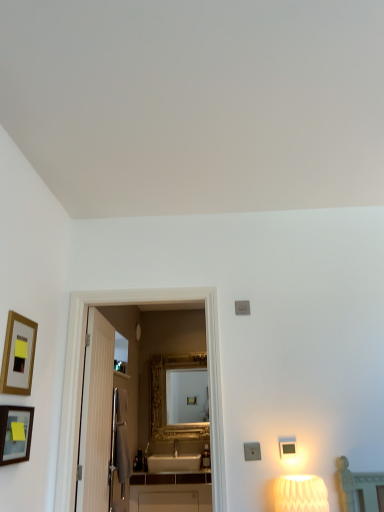
Question: Is gold-framed picture at left, positioned as the 1th picture frame in top-to-bottom order, positioned with its back to white textured lampshade at lower right?

Choices:
 (A) no
 (B) yes

Answer: (A)

Question: Would you say gold-framed picture at left, positioned as the 1th picture frame in top-to-bottom order, contains white textured lampshade at lower right?

Choices:
 (A) no
 (B) yes

Answer: (A)

Question: Is gold-framed picture at left, which ranks as the second picture frame in bottom-to-top order, shorter than white textured lampshade at lower right?

Choices:
 (A) yes
 (B) no

Answer: (B)

Question: Is gold-framed picture at left, positioned as the 1th picture frame in top-to-bottom order, at the left side of white textured lampshade at lower right?

Choices:
 (A) no
 (B) yes

Answer: (B)

Question: Could you tell me if gold-framed picture at left, positioned as the 1th picture frame in top-to-bottom order, is facing white textured lampshade at lower right?

Choices:
 (A) yes
 (B) no

Answer: (A)

Question: Is gold-framed picture at left, positioned as the 1th picture frame in top-to-bottom order, next to white textured lampshade at lower right and touching it?

Choices:
 (A) yes
 (B) no

Answer: (B)

Question: Can you confirm if gold ornate mirror at center is shorter than white glossy cabinet at center?

Choices:
 (A) yes
 (B) no

Answer: (B)

Question: Is gold ornate mirror at center further to the viewer compared to white glossy cabinet at center?

Choices:
 (A) no
 (B) yes

Answer: (B)

Question: Is gold ornate mirror at center aimed at white glossy cabinet at center?

Choices:
 (A) no
 (B) yes

Answer: (A)

Question: From a real-world perspective, is gold ornate mirror at center beneath white glossy cabinet at center?

Choices:
 (A) yes
 (B) no

Answer: (B)

Question: Does gold ornate mirror at center have a greater width compared to white glossy cabinet at center?

Choices:
 (A) no
 (B) yes

Answer: (A)

Question: Is white glossy cabinet at center located within gold ornate mirror at center?

Choices:
 (A) yes
 (B) no

Answer: (B)

Question: Considering the relative sizes of gold-framed picture at left, positioned as the 1th picture frame in top-to-bottom order, and matte gold picture frame at left, placed as the 2th picture frame when sorted from top to bottom, in the image provided, is gold-framed picture at left, positioned as the 1th picture frame in top-to-bottom order, thinner than matte gold picture frame at left, placed as the 2th picture frame when sorted from top to bottom,?

Choices:
 (A) yes
 (B) no

Answer: (A)